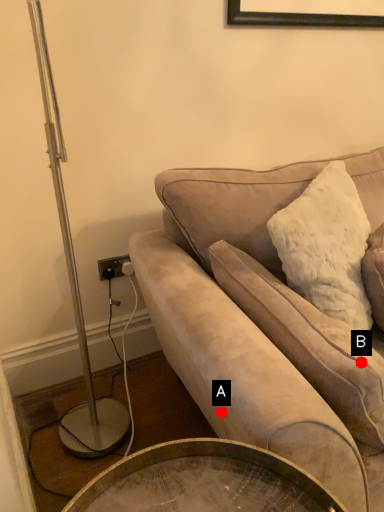
Question: Two points are circled on the image, labeled by A and B beside each circle. Which point is farther from the camera taking this photo?

Choices:
 (A) A is further
 (B) B is further

Answer: (A)